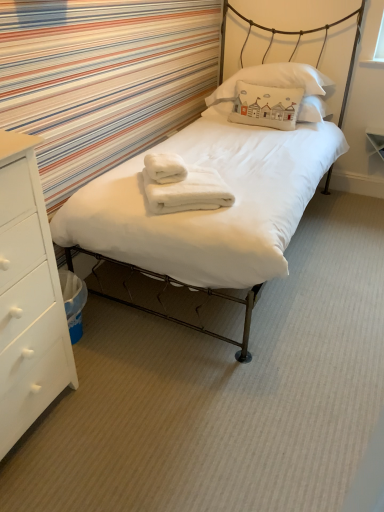
Where is `empty space that is to the right of white matte chest of drawers at left`? The height and width of the screenshot is (512, 384). empty space that is to the right of white matte chest of drawers at left is located at coordinates (118, 415).